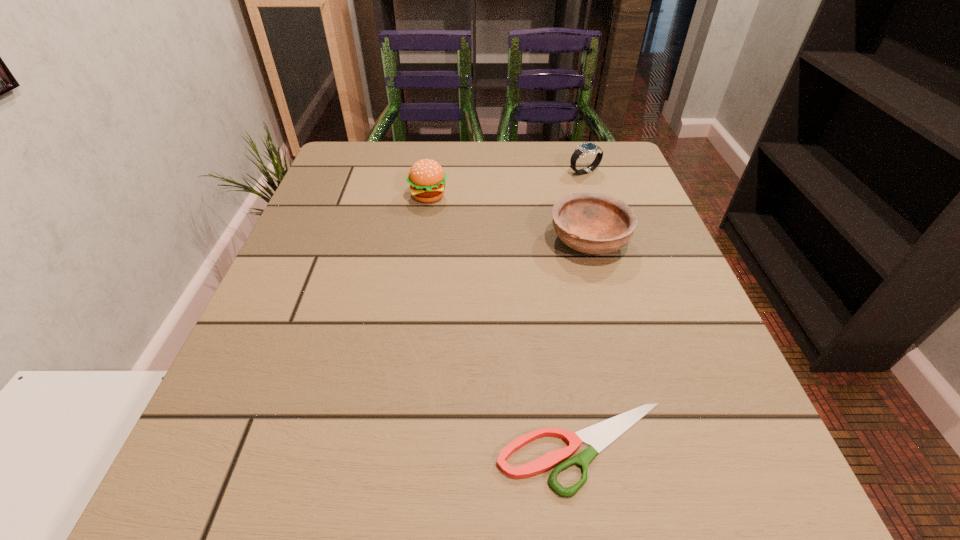
Locate an element on the screen. This screenshot has height=540, width=960. hamburger at the far edge is located at coordinates (426, 177).

You are a GUI agent. You are given a task and a screenshot of the screen. Output one action in this format:
    pyautogui.click(x=<x>, y=<y>)
    Task: Click on the watch present at the far edge
    This screenshot has width=960, height=540.
    Given the screenshot: What is the action you would take?
    coord(584,149)

Locate an element on the screen. object present at the near edge is located at coordinates (598, 436).

What are the coordinates of `watch that is at the right edge` in the screenshot? It's located at (584, 149).

Where is `bowl at the right edge`? This screenshot has height=540, width=960. bowl at the right edge is located at coordinates (589, 222).

You are a GUI agent. You are given a task and a screenshot of the screen. Output one action in this format:
    pyautogui.click(x=<x>, y=<y>)
    Task: Click on the scissors at the right edge
    The image size is (960, 540).
    Given the screenshot: What is the action you would take?
    pyautogui.click(x=598, y=436)

This screenshot has height=540, width=960. Identify the location of object located in the far right corner section of the desktop. (584, 149).

In order to click on object present at the near right corner in this screenshot , I will do `click(598, 436)`.

You are a GUI agent. You are given a task and a screenshot of the screen. Output one action in this format:
    pyautogui.click(x=<x>, y=<y>)
    Task: Click on the vacant space at the far edge
    
    Given the screenshot: What is the action you would take?
    pyautogui.click(x=401, y=156)

Image resolution: width=960 pixels, height=540 pixels. Find the location of `vacant space at the left edge of the desktop`. vacant space at the left edge of the desktop is located at coordinates (277, 330).